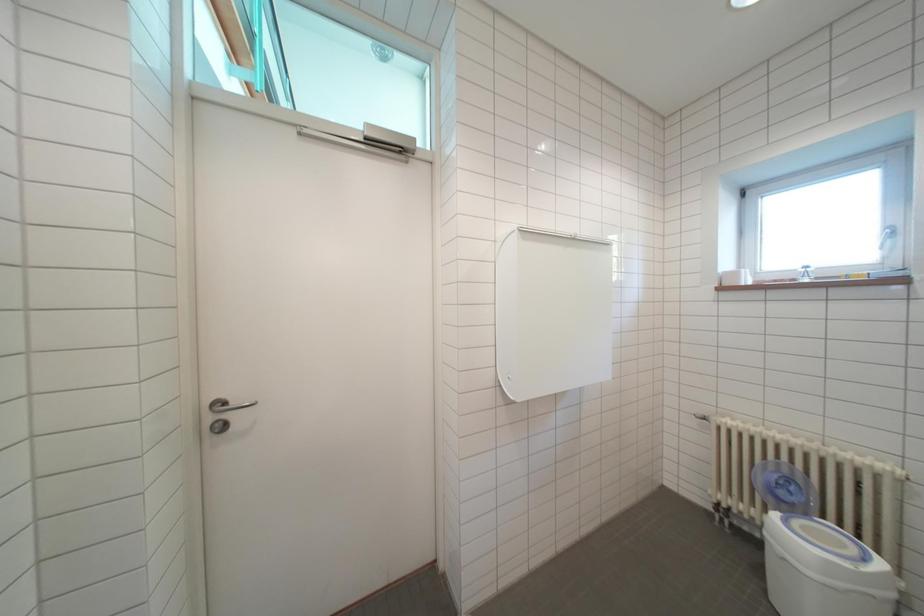
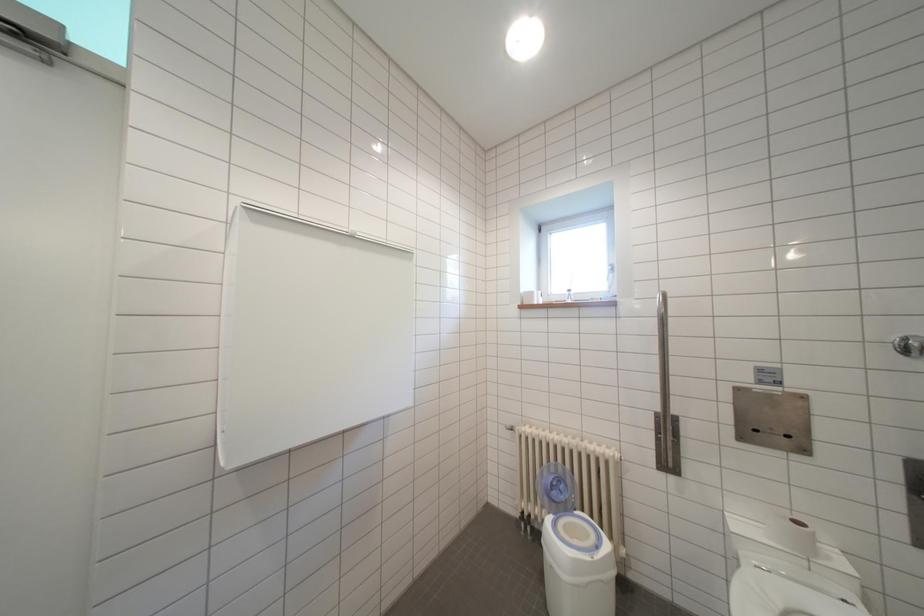
Question: What movement of the cameraman would produce the second image?

Choices:
 (A) Left
 (B) Right
 (C) Forward
 (D) Backward

Answer: (B)